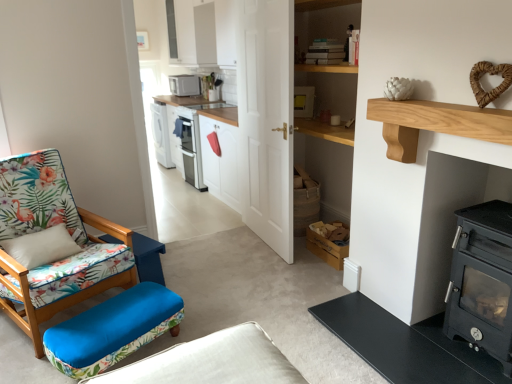
Question: Is blue fabric ottoman at lower left to the left or to the right of black matte wood burning stove at right in the image?

Choices:
 (A) left
 (B) right

Answer: (A)

Question: From their relative heights in the image, would you say blue fabric ottoman at lower left is taller or shorter than black matte wood burning stove at right?

Choices:
 (A) short
 (B) tall

Answer: (A)

Question: Which is nearer to the floral fabric chair at left?

Choices:
 (A) blue fabric swivel chair at left
 (B) white glossy microwave at upper center
 (C) blue fabric ottoman at lower left
 (D) blue floral fabric studio couch at lower left
 (E) black matte wood burning stove at right

Answer: (C)

Question: Which object is the farthest from the light brown wood at upper right?

Choices:
 (A) blue floral fabric studio couch at lower left
 (B) floral fabric chair at left
 (C) black matte wood burning stove at right
 (D) white glossy microwave at upper center
 (E) blue fabric swivel chair at left

Answer: (D)